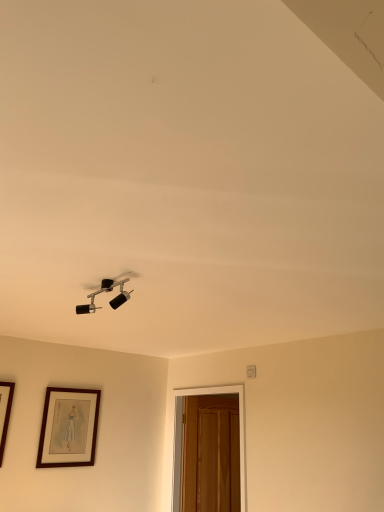
Question: Is matte black light fixture at upper center located outside wooden door at lower right?

Choices:
 (A) no
 (B) yes

Answer: (B)

Question: Is matte black light fixture at upper center to the left of wooden door at lower right from the viewer's perspective?

Choices:
 (A) no
 (B) yes

Answer: (B)

Question: From the image's perspective, does matte black light fixture at upper center appear lower than wooden door at lower right?

Choices:
 (A) yes
 (B) no

Answer: (B)

Question: From a real-world perspective, is matte black light fixture at upper center on top of wooden door at lower right?

Choices:
 (A) no
 (B) yes

Answer: (B)

Question: Is matte black light fixture at upper center positioned far away from wooden door at lower right?

Choices:
 (A) yes
 (B) no

Answer: (A)

Question: Is matte black light fixture at upper center at the right side of wooden door at lower right?

Choices:
 (A) yes
 (B) no

Answer: (B)

Question: Considering the relative sizes of matte black light fixture at upper center and brown wooden picture frame at lower left in the image provided, is matte black light fixture at upper center smaller than brown wooden picture frame at lower left?

Choices:
 (A) no
 (B) yes

Answer: (B)

Question: From the image's perspective, would you say matte black light fixture at upper center is positioned over brown wooden picture frame at lower left?

Choices:
 (A) no
 (B) yes

Answer: (B)

Question: Can you confirm if matte black light fixture at upper center is taller than brown wooden picture frame at lower left?

Choices:
 (A) no
 (B) yes

Answer: (A)

Question: From a real-world perspective, does matte black light fixture at upper center sit lower than brown wooden picture frame at lower left?

Choices:
 (A) yes
 (B) no

Answer: (B)

Question: Considering the relative sizes of matte black light fixture at upper center and brown wooden picture frame at lower left in the image provided, is matte black light fixture at upper center bigger than brown wooden picture frame at lower left?

Choices:
 (A) no
 (B) yes

Answer: (A)

Question: Considering the relative sizes of matte black light fixture at upper center and brown wooden picture frame at lower left in the image provided, is matte black light fixture at upper center thinner than brown wooden picture frame at lower left?

Choices:
 (A) yes
 (B) no

Answer: (B)

Question: Is wooden door at lower right shorter than matte black light fixture at upper center?

Choices:
 (A) yes
 (B) no

Answer: (B)